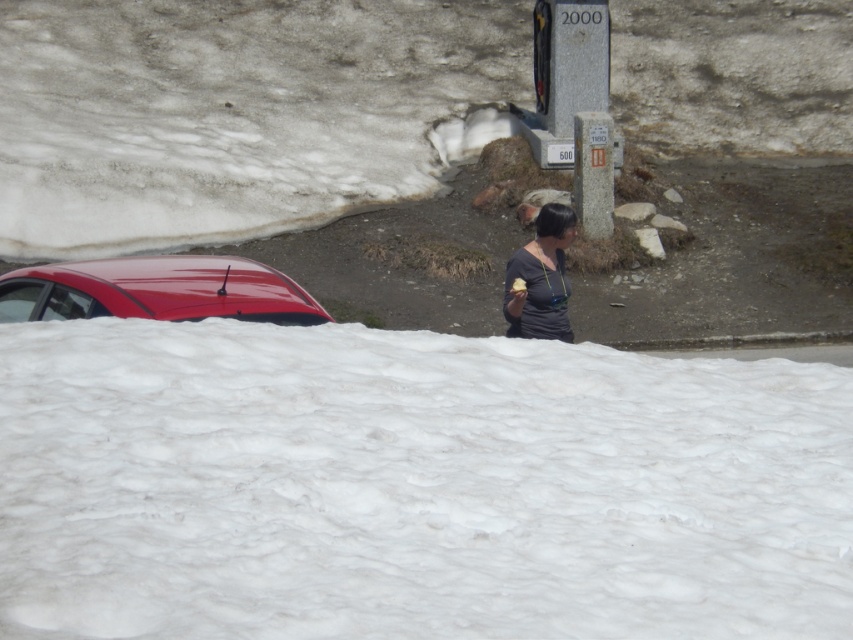
Which is behind, point (569, 337) or point (524, 289)?

The point (569, 337) is more distant.

Describe the element at coordinates (541, 278) in the screenshot. Image resolution: width=853 pixels, height=640 pixels. I see `dark gray matte shirt at center` at that location.

The width and height of the screenshot is (853, 640). Describe the element at coordinates (541, 278) in the screenshot. I see `dark gray matte shirt at center` at that location.

Locate an element on the screen. The height and width of the screenshot is (640, 853). dark gray matte shirt at center is located at coordinates (541, 278).

Who is positioned more to the left, white fluffy snow at lower center or glossy red car at upper left?

From the viewer's perspective, glossy red car at upper left appears more on the left side.

Does white fluffy snow at lower center appear under glossy red car at upper left?

Correct, white fluffy snow at lower center is located below glossy red car at upper left.

Is point (579, 595) farther from camera compared to point (107, 262)?

That is False.

Locate an element on the screen. This screenshot has height=640, width=853. white fluffy snow at lower center is located at coordinates (413, 486).

Can you confirm if glossy red car at upper left is thinner than vanilla ice cream at center?

No.

Is glossy red car at upper left positioned in front of vanilla ice cream at center?

Yes.

You are a GUI agent. You are given a task and a screenshot of the screen. Output one action in this format:
    pyautogui.click(x=<x>, y=<y>)
    Task: Click on the glossy red car at upper left
    This screenshot has width=853, height=640.
    Given the screenshot: What is the action you would take?
    pyautogui.click(x=167, y=289)